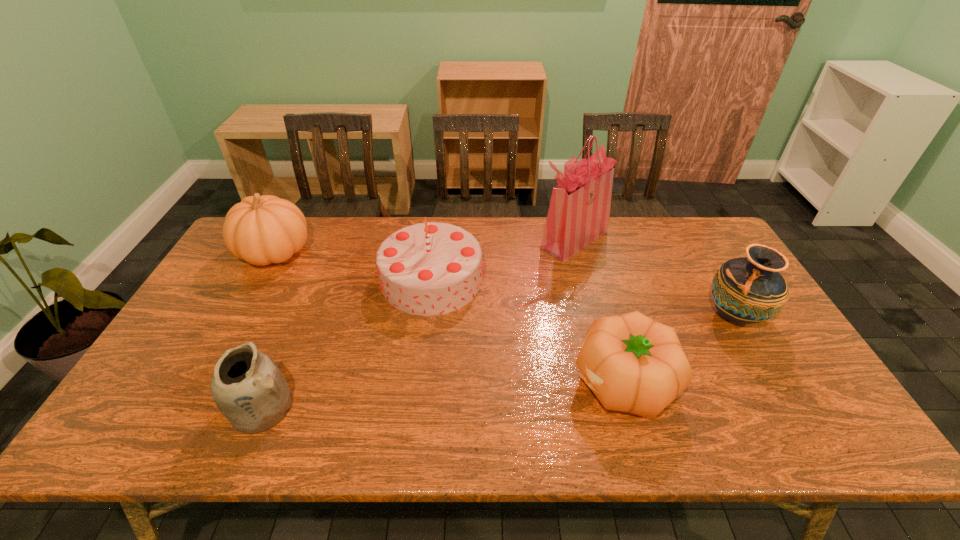
Where is `free space located 0.270m on the front of the tallest object`? Image resolution: width=960 pixels, height=540 pixels. free space located 0.270m on the front of the tallest object is located at coordinates (596, 325).

I want to click on vacant area located on the front of the birthday cake, so click(417, 401).

Where is `vacant space located 0.200m on the right of the taller pumpkin`? Image resolution: width=960 pixels, height=540 pixels. vacant space located 0.200m on the right of the taller pumpkin is located at coordinates (372, 253).

Identify the location of free location located on the front of the rightmost object. (803, 433).

In order to click on vacant space positioned on the carved face of the right pumpkin in this screenshot , I will do `click(468, 382)`.

Where is `free location located on the carved face of the right pumpkin`? Image resolution: width=960 pixels, height=540 pixels. free location located on the carved face of the right pumpkin is located at coordinates (461, 382).

This screenshot has width=960, height=540. What are the coordinates of `free spot located 0.310m on the carved face of the right pumpkin` in the screenshot? It's located at (444, 382).

The image size is (960, 540). Identify the location of vacant space located 0.080m on the left of the shorter pottery. (196, 407).

Locate an element on the screen. This screenshot has width=960, height=540. shopping bag at the far edge is located at coordinates (579, 210).

This screenshot has width=960, height=540. Find the location of `birthday cake present at the far edge`. birthday cake present at the far edge is located at coordinates (426, 269).